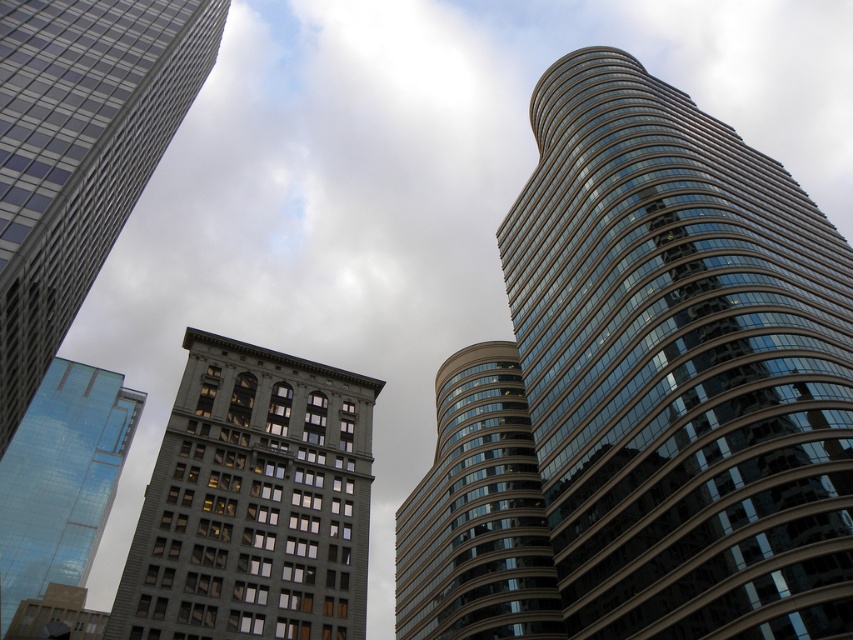
Does glassy reflective building at center come in front of glassy reflective skyscraper at left?

Yes.

What do you see at coordinates (477, 513) in the screenshot? I see `glassy reflective building at center` at bounding box center [477, 513].

I want to click on glassy reflective building at center, so click(477, 513).

Does gray stone building at center have a lesser height compared to glassy reflective skyscraper at left?

Indeed, gray stone building at center has a lesser height compared to glassy reflective skyscraper at left.

Can you confirm if gray stone building at center is wider than glassy reflective skyscraper at left?

No.

Which is in front, point (306, 502) or point (88, 531)?

Point (306, 502)

The image size is (853, 640). Find the location of `gray stone building at center`. gray stone building at center is located at coordinates (253, 502).

Which is in front, point (120, 595) or point (543, 556)?

Positioned in front is point (120, 595).

Measure the distance between point [260,620] and camera.

The distance of point [260,620] from camera is 55.18 meters.

Does point (219, 488) come closer to viewer compared to point (500, 476)?

That is True.

Identify the location of gray stone building at center. The width and height of the screenshot is (853, 640). (253, 502).